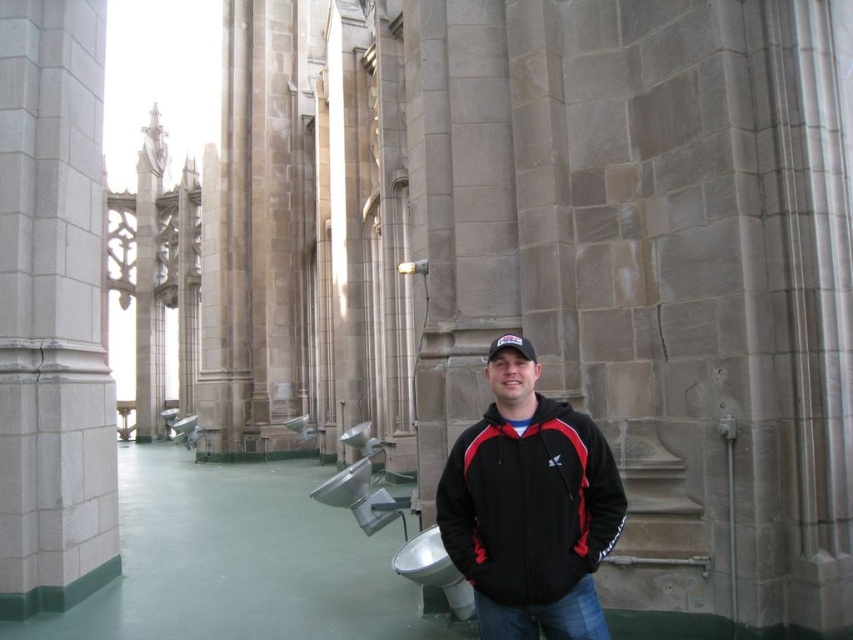
You are an interior designer assessing the space between the gray stone pillar at left and the black fleece jacket at center. Which object is narrower?

The gray stone pillar at left is narrower than the black fleece jacket at center.

You are an architect designing a new exhibition space in this grand structure. You need to place a 25 meter long sculpture between the gray stone pillar at left and the black fleece jacket at center. Is there enough space?

The distance between the gray stone pillar at left and the black fleece jacket at center is 24.23 meters, so the 25 meter long sculpture would not fit as it exceeds the available space by 0.77 meters.

From the picture: You are an architect assessing the proportions of the space. Considering the gray stone pillar at left and the black fleece jacket at center, which object is significantly taller?

The gray stone pillar at left is much taller than the black fleece jacket at center.